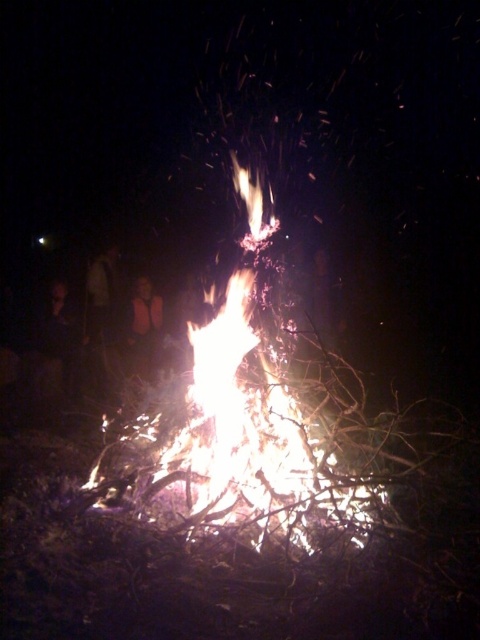
You are a photographer standing at the edge of the scene. You want to capture a photo where both the bright orange flames at center and the dark fabric shirt at left are clearly visible in the frame. Given their distance apart, is it possible to fit both into a standard camera shot without moving your position?

The bright orange flames at center and dark fabric shirt at left are 4.38 meters apart. A standard camera shot can typically capture objects within a 6 meter range, so yes, both can be included in the frame without moving your position.

You are standing near the bonfire and want to hand a marshmallow to the person wearing the orange vest at center and the dark fabric shirt at left. Which person will you reach first if you move straight forward?

You will reach the orange vest at center first because it is closer to you than the dark fabric shirt at left, which is further away.

You are a photographer trying to capture the bright orange flames at center and the dark fabric shirt at left in the same frame. Based on their positions, which object should you adjust your camera to focus on first to ensure both are in the shot?

Since the bright orange flames at center are to the right of the dark fabric shirt at left, you should focus on the dark fabric shirt at left first to ensure both objects are within the frame.